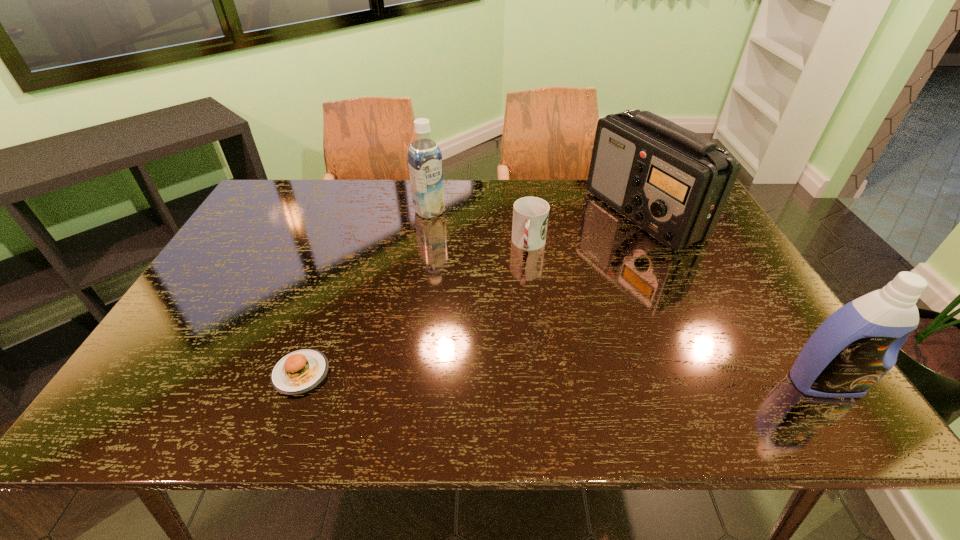
Identify the location of free spot between the cup and the shortest object. [x=415, y=309].

The width and height of the screenshot is (960, 540). Find the location of `free space between the detergent and the radio receiver`. free space between the detergent and the radio receiver is located at coordinates (734, 299).

Find the location of a particular element. The width and height of the screenshot is (960, 540). the third closest object to the radio receiver is located at coordinates (425, 165).

This screenshot has width=960, height=540. I want to click on the second closest object relative to the third object from left to right, so click(425, 165).

In order to click on vacant space that satisfies the following two spatial constraints: 1. on the front side of the detergent; 2. on the right side of the radio receiver in this screenshot , I will do `click(727, 383)`.